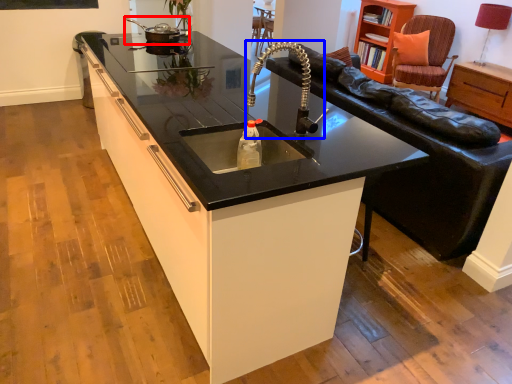
Question: Among these objects, which one is nearest to the camera, appliance (highlighted by a red box) or faucet (highlighted by a blue box)?

Choices:
 (A) appliance
 (B) faucet

Answer: (B)